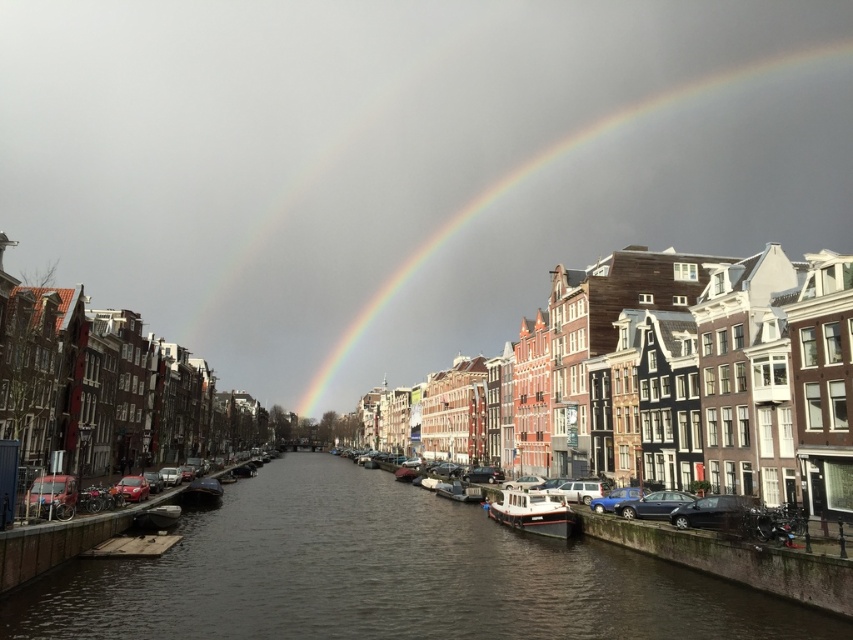
Question: Can you confirm if white glossy boat at center is thinner than smooth wooden boat at center?

Choices:
 (A) no
 (B) yes

Answer: (A)

Question: Observing the image, what is the correct spatial positioning of rainbow at upper center in reference to wooden boat at center?

Choices:
 (A) above
 (B) below

Answer: (A)

Question: Considering the real-world distances, which object is farthest from the dark gray water at center?

Choices:
 (A) wooden boat at center
 (B) white glossy boat at center
 (C) smooth wooden boat at center

Answer: (A)

Question: Which of the following is the farthest from the observer?

Choices:
 (A) pos(816,49)
 (B) pos(164,516)
 (C) pos(506,524)

Answer: (A)

Question: Which point is closer to the camera?

Choices:
 (A) white glossy boat at center
 (B) rainbow at upper center
 (C) wooden boat at center

Answer: (A)

Question: Does rainbow at upper center come behind smooth wooden boat at center?

Choices:
 (A) yes
 (B) no

Answer: (A)